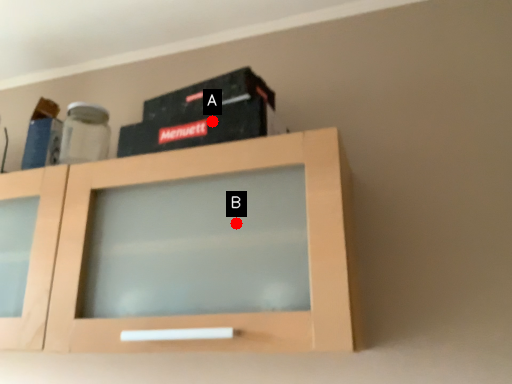
Question: Two points are circled on the image, labeled by A and B beside each circle. Which point is farther to the camera?

Choices:
 (A) A is further
 (B) B is further

Answer: (A)